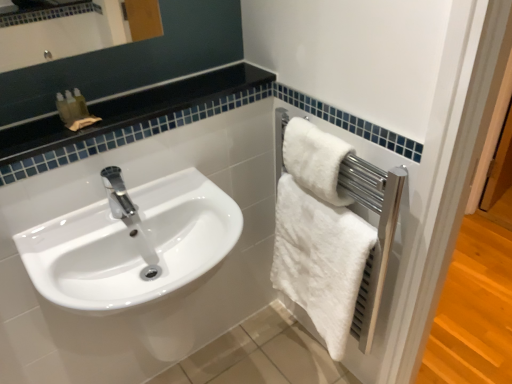
Question: Is white fluffy towel at right, the first towel in the top-to-bottom sequence, in front of or behind white glossy sink at left in the image?

Choices:
 (A) front
 (B) behind

Answer: (B)

Question: From a real-world perspective, is white fluffy towel at right, the first towel in the top-to-bottom sequence, physically located above or below white glossy sink at left?

Choices:
 (A) above
 (B) below

Answer: (A)

Question: Estimate the real-world distances between objects in this image. Which object is closer to the white glossy sink at left?

Choices:
 (A) white fluffy towel at right, the second towel from the top
 (B) black glossy countertop at upper left
 (C) white fluffy towel at right, which is counted as the 2th towel, starting from the bottom

Answer: (B)

Question: Estimate the real-world distances between objects in this image. Which object is closer to the white glossy sink at left?

Choices:
 (A) white fluffy towel at right, the first towel ordered from the bottom
 (B) black glossy countertop at upper left
 (C) white fluffy towel at right, which is counted as the 2th towel, starting from the bottom

Answer: (B)